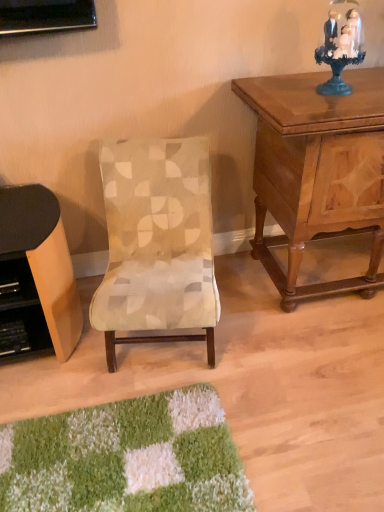
Where is `blue glass figurine at upper right`? blue glass figurine at upper right is located at coordinates pyautogui.click(x=340, y=45).

What is the approximate height of beige fabric chair at center?

27.45 inches.

Where is `wooden nightstand at upper right`? The height and width of the screenshot is (512, 384). wooden nightstand at upper right is located at coordinates (317, 170).

From the image's perspective, is light brown wood desk at left located above or below wooden nightstand at upper right?

light brown wood desk at left is below wooden nightstand at upper right.

Considering their positions, is light brown wood desk at left located in front of or behind wooden nightstand at upper right?

Visually, light brown wood desk at left is located behind wooden nightstand at upper right.

How distant is light brown wood desk at left from wooden nightstand at upper right?

The distance of light brown wood desk at left from wooden nightstand at upper right is 35.16 inches.

Which of these two, light brown wood desk at left or wooden nightstand at upper right, is smaller?

With smaller size is light brown wood desk at left.

Visually, is light brown wood desk at left positioned to the left or to the right of beige fabric chair at center?

Based on their positions, light brown wood desk at left is located to the left of beige fabric chair at center.

Is light brown wood desk at left wider than beige fabric chair at center?

No.

Would you consider light brown wood desk at left to be distant from beige fabric chair at center?

No, light brown wood desk at left is in close proximity to beige fabric chair at center.

Which point is more distant from viewer, (333,5) or (56,200)?

The point (56,200) is more distant.

Would you consider blue glass figurine at upper right to be distant from light brown wood desk at left?

Yes.

From the image's perspective, does blue glass figurine at upper right appear lower than light brown wood desk at left?

No.

How different are the orientations of blue glass figurine at upper right and light brown wood desk at left in degrees?

1.6 degrees.

From the picture: Considering the sizes of wooden nightstand at upper right and blue glass figurine at upper right in the image, is wooden nightstand at upper right wider or thinner than blue glass figurine at upper right?

Clearly, wooden nightstand at upper right has more width compared to blue glass figurine at upper right.

The height and width of the screenshot is (512, 384). In order to click on table lamp above the wooden nightstand at upper right (from a real-world perspective) in this screenshot , I will do click(x=340, y=45).

Is wooden nightstand at upper right to the left of blue glass figurine at upper right from the viewer's perspective?

Incorrect, wooden nightstand at upper right is not on the left side of blue glass figurine at upper right.

Who is shorter, wooden nightstand at upper right or blue glass figurine at upper right?

With less height is blue glass figurine at upper right.

Is wooden nightstand at upper right aimed at light brown wood desk at left?

No.

From the image's perspective, is wooden nightstand at upper right located above or below light brown wood desk at left?

wooden nightstand at upper right is situated higher than light brown wood desk at left in the image.

Can you confirm if wooden nightstand at upper right is positioned to the right of light brown wood desk at left?

Yes, wooden nightstand at upper right is to the right of light brown wood desk at left.

Considering the relative positions of wooden nightstand at upper right and light brown wood desk at left in the image provided, is wooden nightstand at upper right in front of light brown wood desk at left?

Yes, wooden nightstand at upper right is closer to the camera.

Is blue glass figurine at upper right facing towards beige fabric chair at center?

No, blue glass figurine at upper right does not turn towards beige fabric chair at center.

Can you confirm if blue glass figurine at upper right is shorter than beige fabric chair at center?

Yes, blue glass figurine at upper right is shorter than beige fabric chair at center.

Is blue glass figurine at upper right wider or thinner than beige fabric chair at center?

Considering their sizes, blue glass figurine at upper right looks slimmer than beige fabric chair at center.

Are blue glass figurine at upper right and beige fabric chair at center far apart?

No, blue glass figurine at upper right is not far from beige fabric chair at center.

Is beige fabric chair at center directly adjacent to blue glass figurine at upper right?

beige fabric chair at center is not next to blue glass figurine at upper right, and they're not touching.

Considering the sizes of objects beige fabric chair at center and blue glass figurine at upper right in the image provided, who is smaller, beige fabric chair at center or blue glass figurine at upper right?

With smaller size is blue glass figurine at upper right.

Does beige fabric chair at center contain blue glass figurine at upper right?

No, beige fabric chair at center does not contain blue glass figurine at upper right.

Identify the location of table lamp above the beige fabric chair at center (from the image's perspective). The height and width of the screenshot is (512, 384). (340, 45).

Locate an element on the screen. This screenshot has width=384, height=512. desk below the wooden nightstand at upper right (from a real-world perspective) is located at coordinates (36, 275).

Image resolution: width=384 pixels, height=512 pixels. I want to click on chair on the right of the light brown wood desk at left, so click(157, 243).

Estimate the real-world distances between objects in this image. Which object is further from wooden nightstand at upper right, light brown wood desk at left or blue glass figurine at upper right?

Among the two, light brown wood desk at left is located further to wooden nightstand at upper right.

From the image, which object appears to be farther from beige fabric chair at center, light brown wood desk at left or blue glass figurine at upper right?

blue glass figurine at upper right is positioned further to the anchor beige fabric chair at center.

Considering their positions, is beige fabric chair at center positioned further to wooden nightstand at upper right than blue glass figurine at upper right?

beige fabric chair at center is positioned further to the anchor wooden nightstand at upper right.

Estimate the real-world distances between objects in this image. Which object is further from light brown wood desk at left, beige fabric chair at center or wooden nightstand at upper right?

wooden nightstand at upper right is positioned further to the anchor light brown wood desk at left.

Estimate the real-world distances between objects in this image. Which object is further from wooden nightstand at upper right, blue glass figurine at upper right or beige fabric chair at center?

Based on the image, beige fabric chair at center appears to be further to wooden nightstand at upper right.

Looking at the image, which one is located closer to light brown wood desk at left, wooden nightstand at upper right or beige fabric chair at center?

Based on the image, beige fabric chair at center appears to be nearer to light brown wood desk at left.

From the image, which object appears to be nearer to beige fabric chair at center, light brown wood desk at left or wooden nightstand at upper right?

Among the two, light brown wood desk at left is located nearer to beige fabric chair at center.

Considering their positions, is beige fabric chair at center positioned closer to blue glass figurine at upper right than wooden nightstand at upper right?

wooden nightstand at upper right lies closer to blue glass figurine at upper right than the other object.

Where is `chair between light brown wood desk at left and blue glass figurine at upper right from left to right`? chair between light brown wood desk at left and blue glass figurine at upper right from left to right is located at coordinates (157, 243).

You are a GUI agent. You are given a task and a screenshot of the screen. Output one action in this format:
    pyautogui.click(x=<x>, y=<y>)
    Task: Click on the table lamp between beige fabric chair at center and wooden nightstand at upper right from left to right
    
    Given the screenshot: What is the action you would take?
    pyautogui.click(x=340, y=45)

At what (x,y) coordinates should I click in order to perform the action: click on chair between light brown wood desk at left and wooden nightstand at upper right. Please return your answer as a coordinate pair (x, y). The width and height of the screenshot is (384, 512). Looking at the image, I should click on (157, 243).

Locate an element on the screen. The height and width of the screenshot is (512, 384). table lamp situated between light brown wood desk at left and wooden nightstand at upper right from left to right is located at coordinates (340, 45).